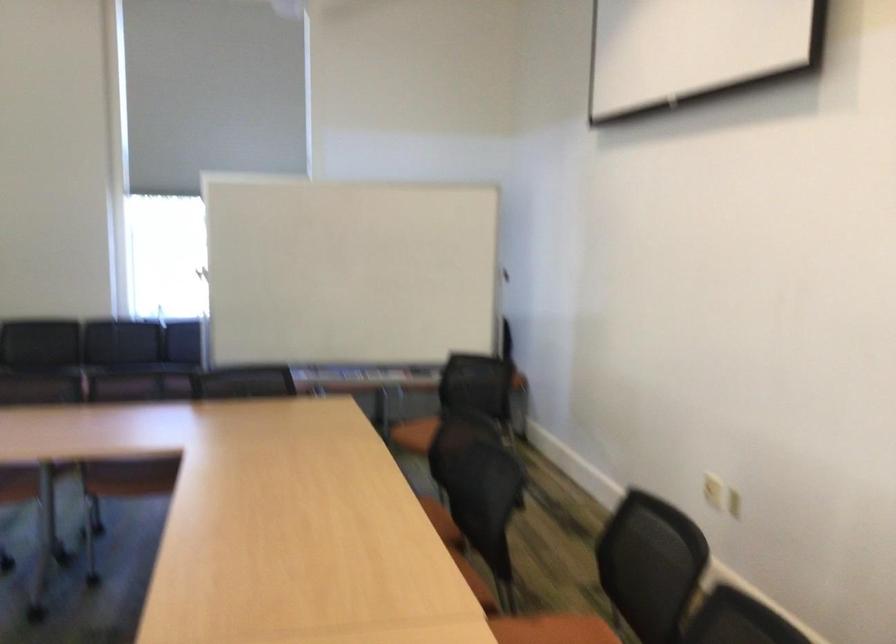
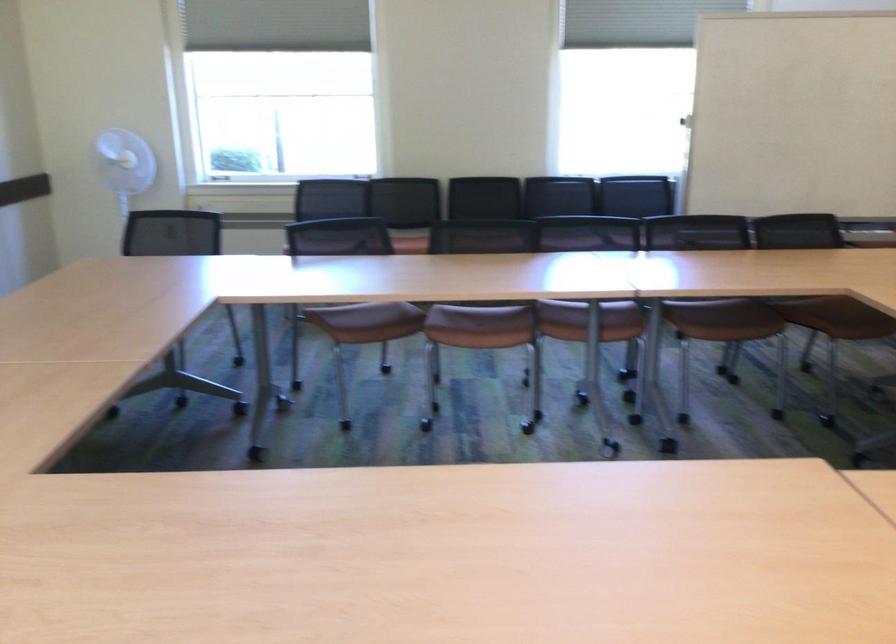
Find the pixel in the second image that matches pixel 178 456 in the first image.

(820, 295)